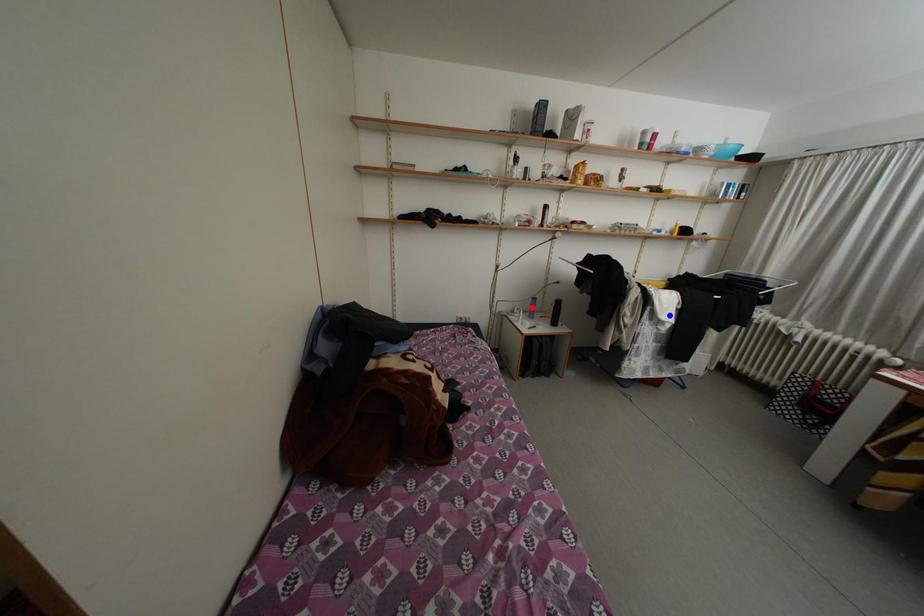
Question: In the image, two points are highlighted. Which point is nearer to the camera? Reply with the corresponding letter.

Choices:
 (A) blue point
 (B) red point

Answer: (A)